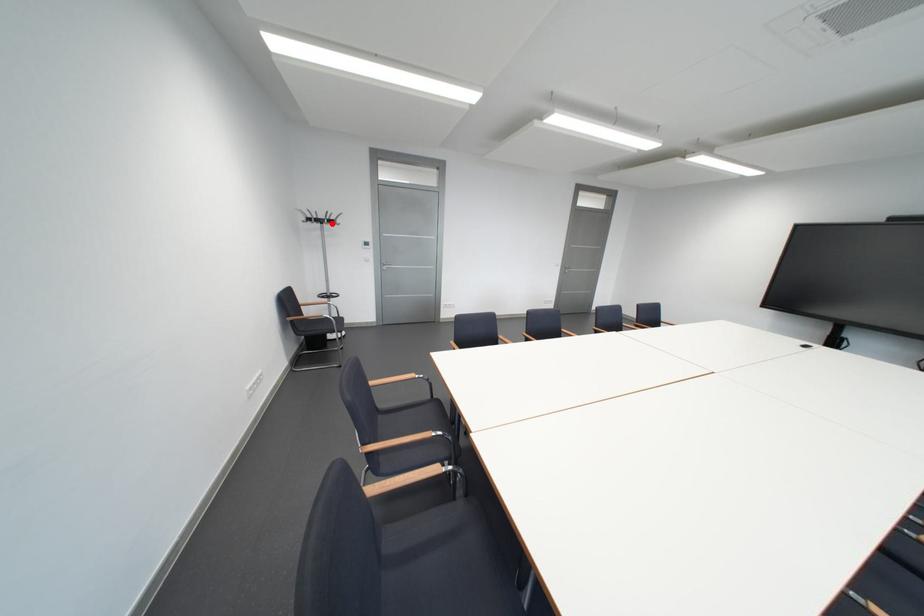
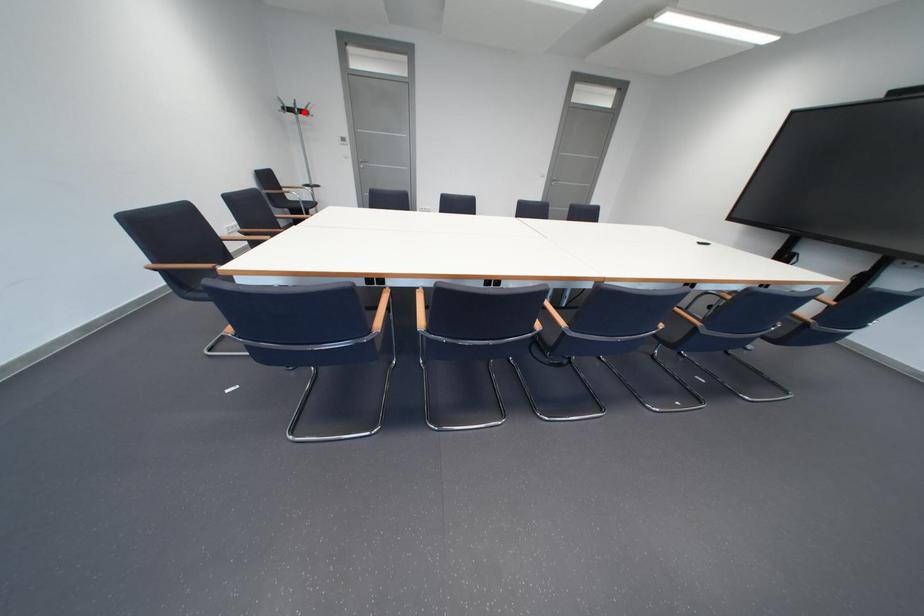
I am providing you with two images of the same scene from different viewpoints. A red point is marked on the first image and another point is marked on the second image. Is the red point in image1 aligned with the point shown in image2?

Yes